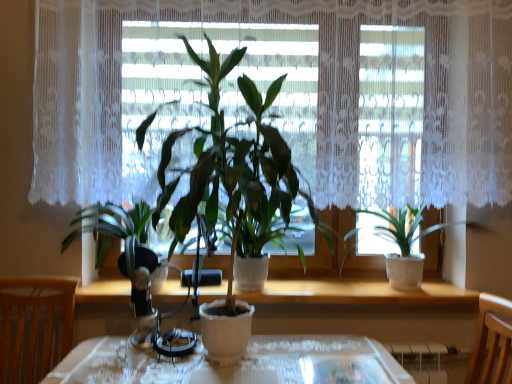
Where is `vacant area situated below green matte plant at right, positioned as the first houseplant in right-to-left order (from a real-world perspective)`? Image resolution: width=512 pixels, height=384 pixels. vacant area situated below green matte plant at right, positioned as the first houseplant in right-to-left order (from a real-world perspective) is located at coordinates (406, 291).